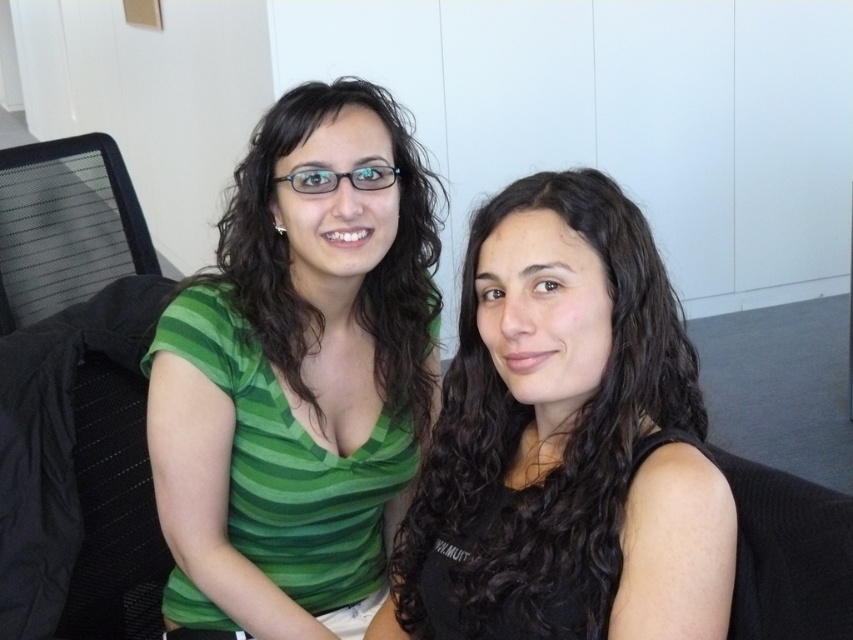
Question: Considering the relative positions of green striped shirt at center and black matte hair at center in the image provided, where is green striped shirt at center located with respect to black matte hair at center?

Choices:
 (A) below
 (B) above

Answer: (B)

Question: Observing the image, what is the correct spatial positioning of green striped shirt at center in reference to black matte hair at center?

Choices:
 (A) above
 (B) below

Answer: (A)

Question: Which object is closer to the camera taking this photo?

Choices:
 (A) green striped shirt at center
 (B) black matte hair at center

Answer: (B)

Question: Is green striped shirt at center further to the viewer compared to black matte hair at center?

Choices:
 (A) yes
 (B) no

Answer: (A)